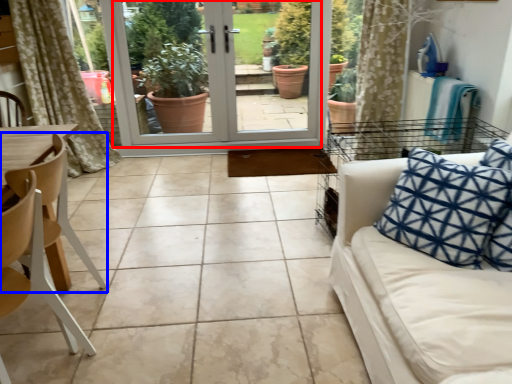
Question: Among these objects, which one is nearest to the camera, screen door (highlighted by a red box) or chair (highlighted by a blue box)?

Choices:
 (A) screen door
 (B) chair

Answer: (B)